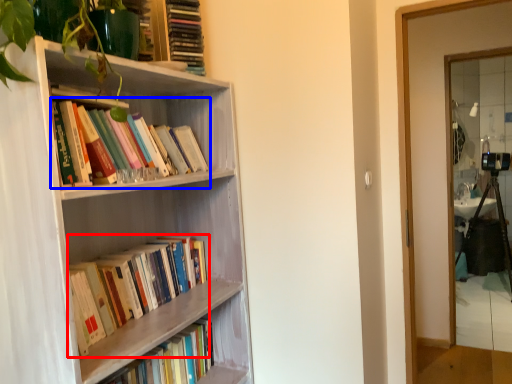
Question: Which point is closer to the camera, book (highlighted by a red box) or book (highlighted by a blue box)?

Choices:
 (A) book
 (B) book

Answer: (B)